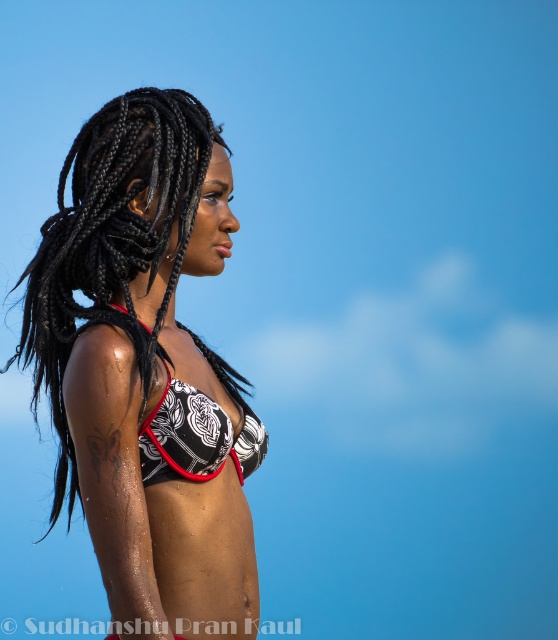
Does printed fabric bikini top at center appear on the left side of black printed bikini top at center?

Yes, printed fabric bikini top at center is to the left of black printed bikini top at center.

Is printed fabric bikini top at center taller than black printed bikini top at center?

Yes, printed fabric bikini top at center is taller than black printed bikini top at center.

Between point (220, 412) and point (163, 426), which one is positioned in front?

Point (163, 426) is in front.

Where is `printed fabric bikini top at center`? Image resolution: width=558 pixels, height=640 pixels. printed fabric bikini top at center is located at coordinates (146, 371).